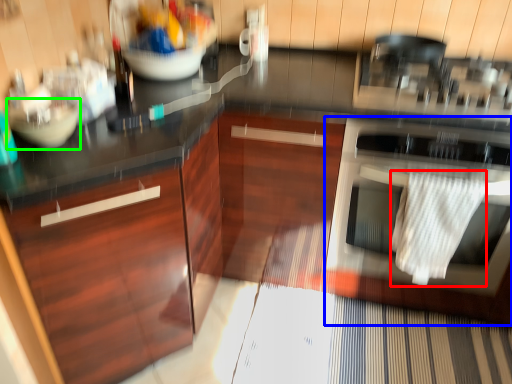
Question: Which is farther away from material (highlighted by a red box)? home appliance (highlighted by a blue box) or mixing bowl (highlighted by a green box)?

Choices:
 (A) home appliance
 (B) mixing bowl

Answer: (B)